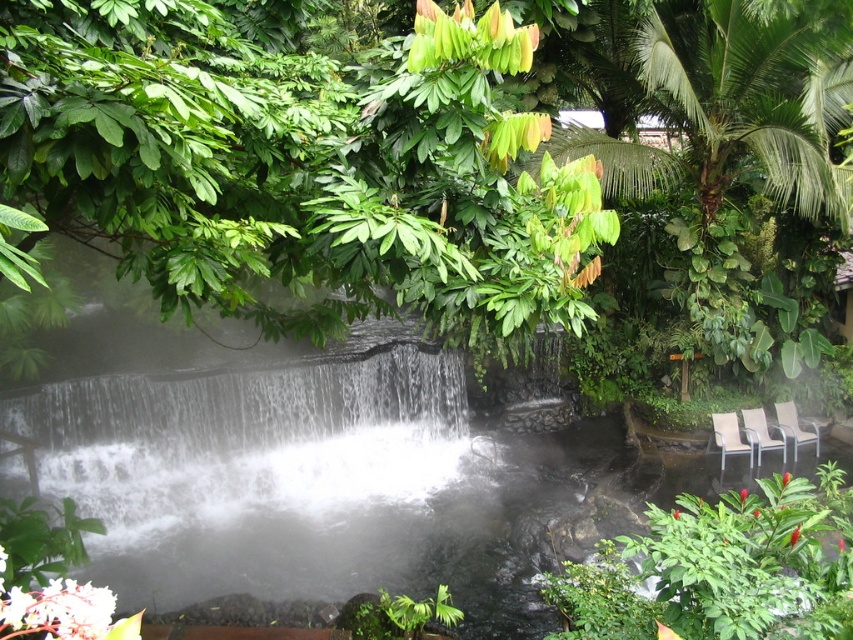
Question: Considering the relative positions of brown woven chair at lower right and metallic silver chair at lower right in the image provided, where is brown woven chair at lower right located with respect to metallic silver chair at lower right?

Choices:
 (A) left
 (B) right

Answer: (A)

Question: Is brown woven chair at lower right above metallic silver chair at lower right?

Choices:
 (A) yes
 (B) no

Answer: (B)

Question: Which point is farther to the camera?

Choices:
 (A) (796, 420)
 (B) (83, 81)
 (C) (712, 412)

Answer: (A)

Question: Observing the image, what is the correct spatial positioning of green leafy tree at upper center in reference to white plastic chair at lower right?

Choices:
 (A) right
 (B) left

Answer: (B)

Question: Which point appears farthest from the camera in this image?

Choices:
 (A) (x=796, y=426)
 (B) (x=15, y=93)
 (C) (x=712, y=429)
 (D) (x=752, y=422)

Answer: (A)

Question: Among these points, which one is nearest to the camera?

Choices:
 (A) (756, 440)
 (B) (184, 214)
 (C) (790, 406)

Answer: (B)